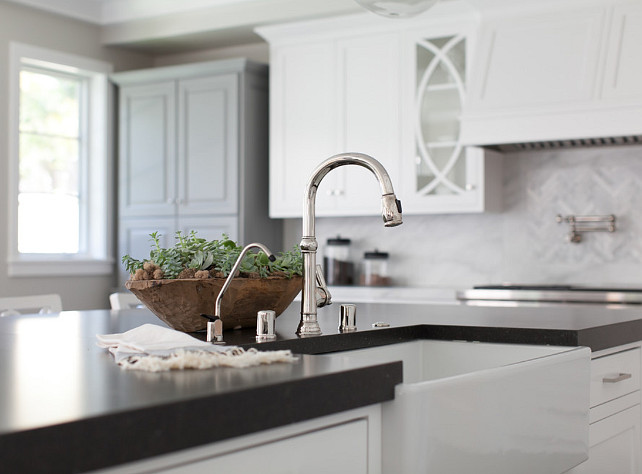
Find the location of a particular element. The width and height of the screenshot is (642, 474). canisters is located at coordinates (334, 254), (372, 275).